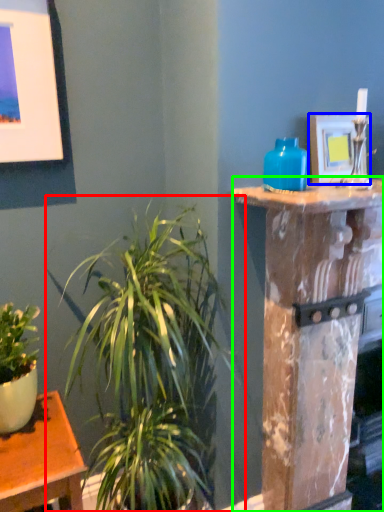
Question: Which object is the farthest from houseplant (highlighted by a red box)? Choose among these: picture frame (highlighted by a blue box) or pillar (highlighted by a green box).

Choices:
 (A) picture frame
 (B) pillar

Answer: (A)